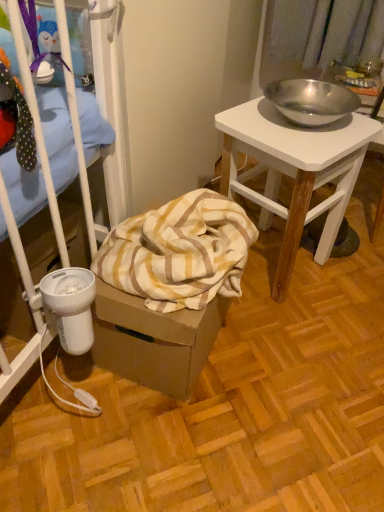
The width and height of the screenshot is (384, 512). In order to click on free point above polished metal bowl at upper right (from a real-world perspective) in this screenshot , I will do `click(298, 124)`.